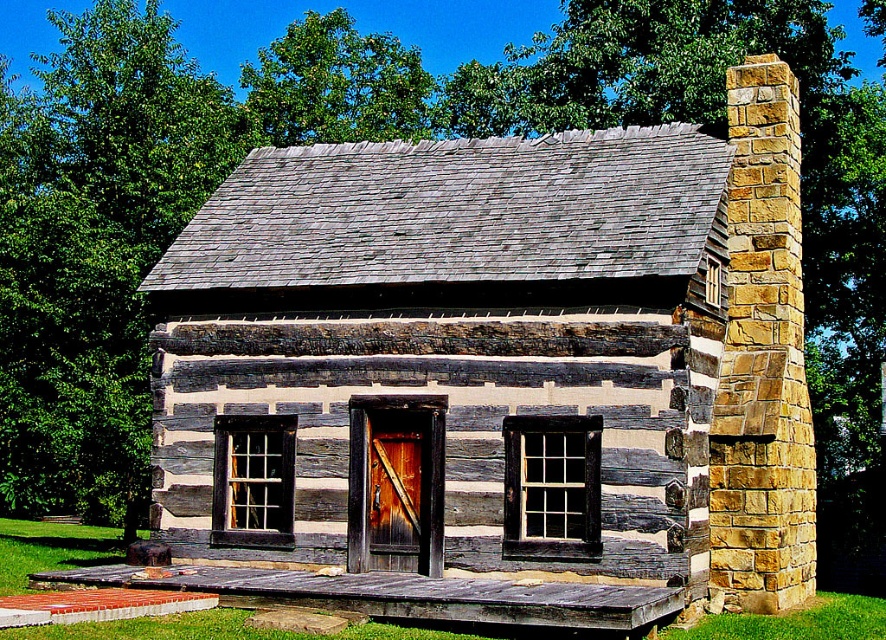
You are a painter who wants to paint the weathered wood cabin at center and the brown wooden door at center. You have a ladder that can reach up to 10 feet. Considering their heights, which one can you paint without needing a ladder?

The weathered wood cabin at center has a greater height compared to the brown wooden door at center. Since the ladder can reach up to 10 feet, you can paint the brown wooden door at center without needing a ladder, but the cabin may require the ladder due to its greater height.

You are standing in front of the weathered wood cabin at center and want to enter through the brown wooden door at center. Considering the cabin is wider than the door, where should you position yourself to find the door?

Since the weathered wood cabin at center is wider than the brown wooden door at center, the door is likely positioned centrally along the cabin. You should stand directly in front of the cabin to locate the brown wooden door at center.

You are a painter who needs to decide which item to paint first. Given that the weathered wood cabin at center is larger than the brown wooden door at center, which one would require more paint?

The weathered wood cabin at center requires more paint because it is larger than the brown wooden door at center.